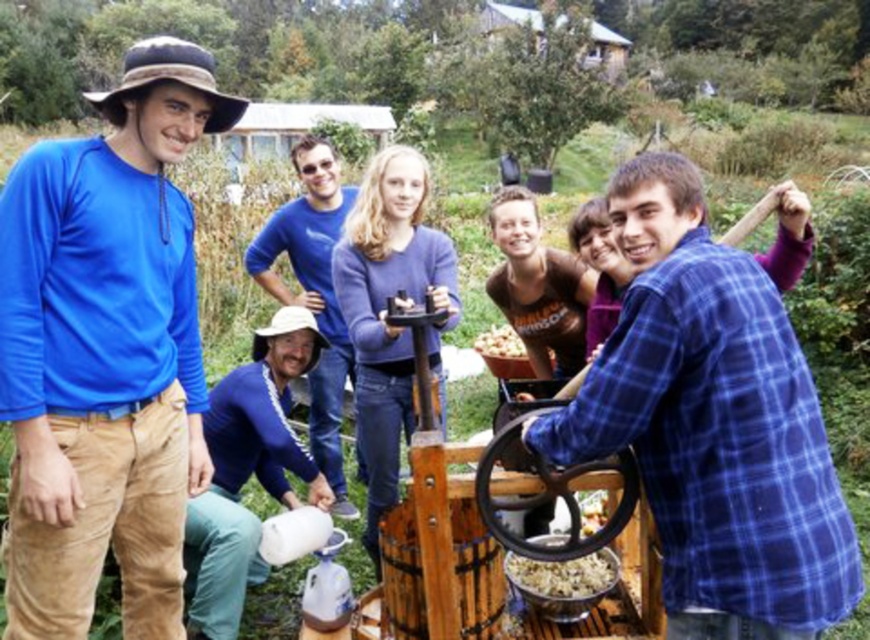
Question: Is blue cotton shirt at left positioned before smooth brown nuts at center?

Choices:
 (A) yes
 (B) no

Answer: (A)

Question: Which point is farther from the camera taking this photo?

Choices:
 (A) (350, 371)
 (B) (44, 152)
 (C) (480, 339)
 (D) (701, 358)

Answer: (C)

Question: Can you confirm if blue plaid shirt at center is bigger than smooth brown nuts at center?

Choices:
 (A) yes
 (B) no

Answer: (A)

Question: Which object appears closest to the camera in this image?

Choices:
 (A) blue plaid shirt at center
 (B) blue cotton shirt at left

Answer: (A)

Question: Which object is the farthest from the smooth brown nuts at center?

Choices:
 (A) blue cotton shirt at center
 (B) blue cotton shirt at left
 (C) blue plaid shirt at center
 (D) crumbly brown food at center

Answer: (C)

Question: Is blue cotton shirt at left above blue plaid shirt at center?

Choices:
 (A) yes
 (B) no

Answer: (A)